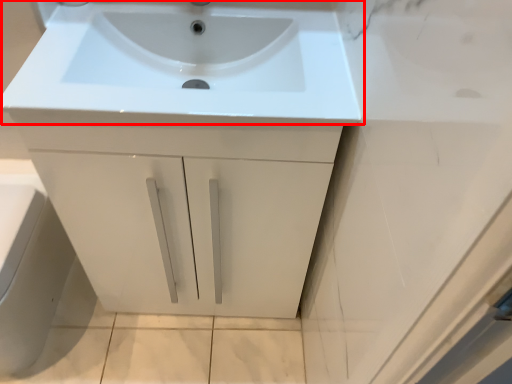
Question: Where is sink (annotated by the red box) located in relation to porcelain in the image?

Choices:
 (A) right
 (B) left

Answer: (A)